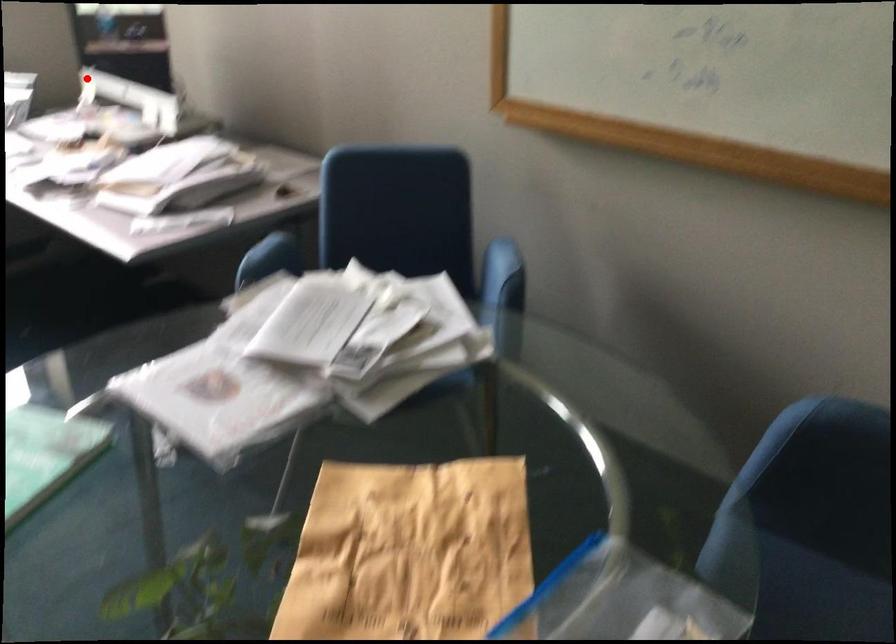
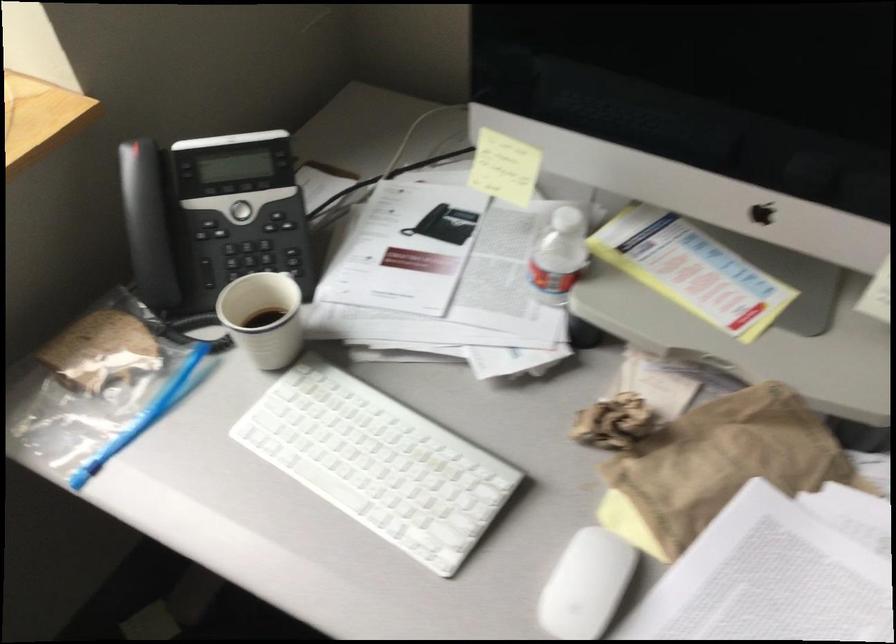
Question: I am providing you with two images of the same scene from different viewpoints. Given a red point in image1, look at the same physical point in image2. Is it:

Choices:
 (A) Closer to the viewpoint
 (B) Farther from the viewpoint

Answer: (A)